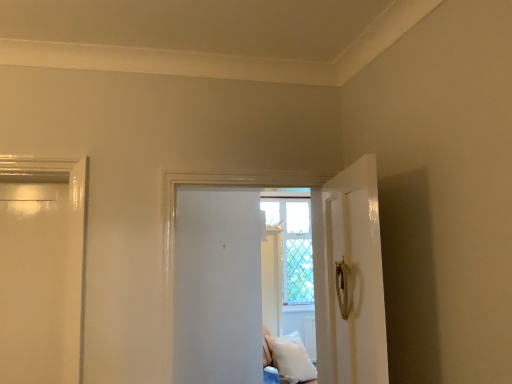
Question: Is white matte door at center to the left or to the right of white soft pillow at lower center in the image?

Choices:
 (A) right
 (B) left

Answer: (B)

Question: In the image, is white matte door at center positioned in front of or behind white soft pillow at lower center?

Choices:
 (A) behind
 (B) front

Answer: (B)

Question: Which of these objects is positioned farthest from the white soft pillow at lower center?

Choices:
 (A) clear glass window at center
 (B) white matte door at center

Answer: (B)

Question: Based on their relative distances, which object is nearer to the white matte door at center?

Choices:
 (A) clear glass window at center
 (B) white soft pillow at lower center

Answer: (B)